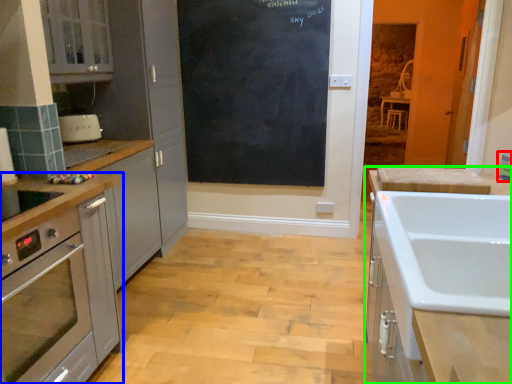
Question: Considering the real-world distances, which object is farthest from appliance (highlighted by a red box)? cabinetry (highlighted by a blue box) or cabinetry (highlighted by a green box)?

Choices:
 (A) cabinetry
 (B) cabinetry

Answer: (A)